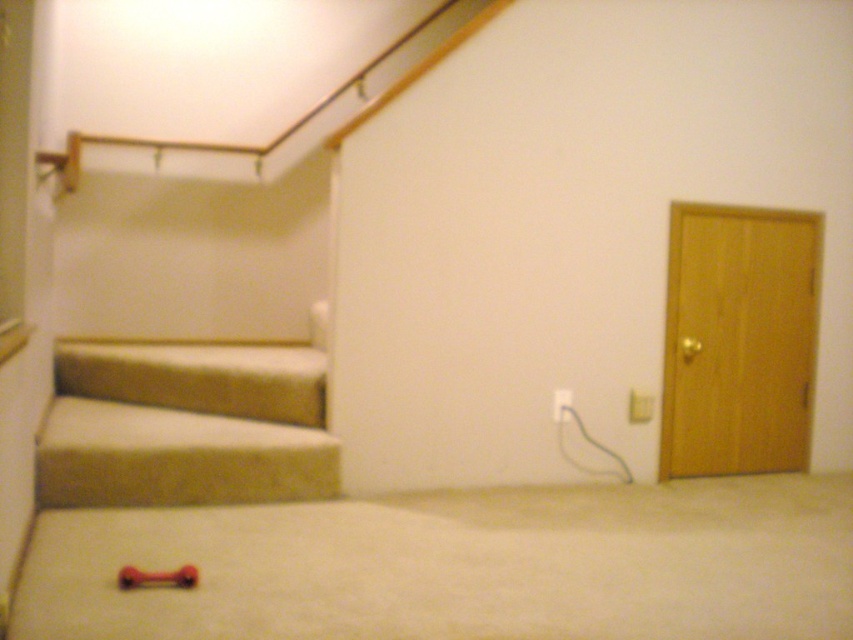
You are standing at the bottom of the beige carpeted stairs at lower left in the room. You want to move to the door on the right wall. Is the point at coordinates (184, 426) located on the staircase?

The point at coordinates (184, 426) is located on the beige carpeted stairs at lower left, so yes, it is on the staircase.